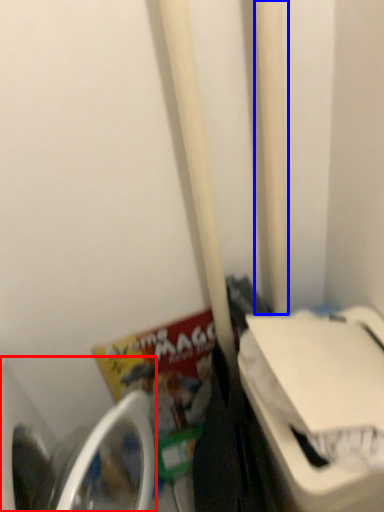
Question: Which point is closer to the camera, washing machine (highlighted by a red box) or pole (highlighted by a blue box)?

Choices:
 (A) washing machine
 (B) pole

Answer: (A)